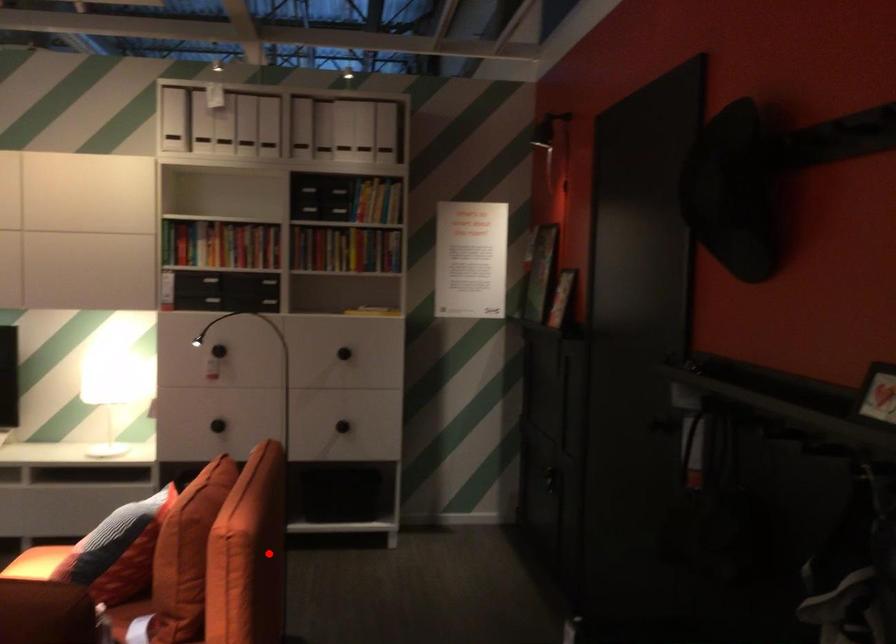
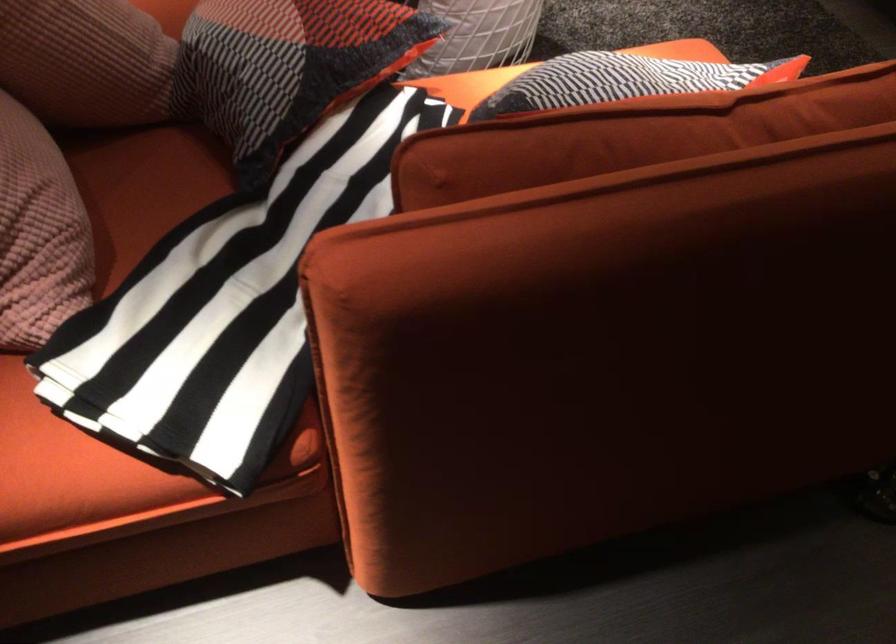
Question: I am providing you with two images of the same scene from different viewpoints. Image1 has a red point marked. In image2, the corresponding 3D location appears at what relative position? Reply with the corresponding letter.

Choices:
 (A) Closer
 (B) Farther

Answer: (A)